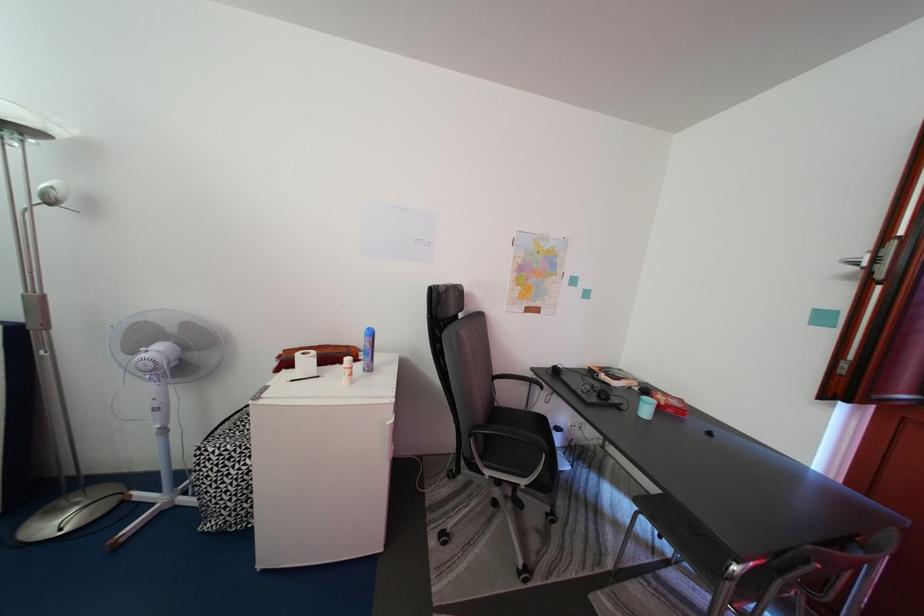
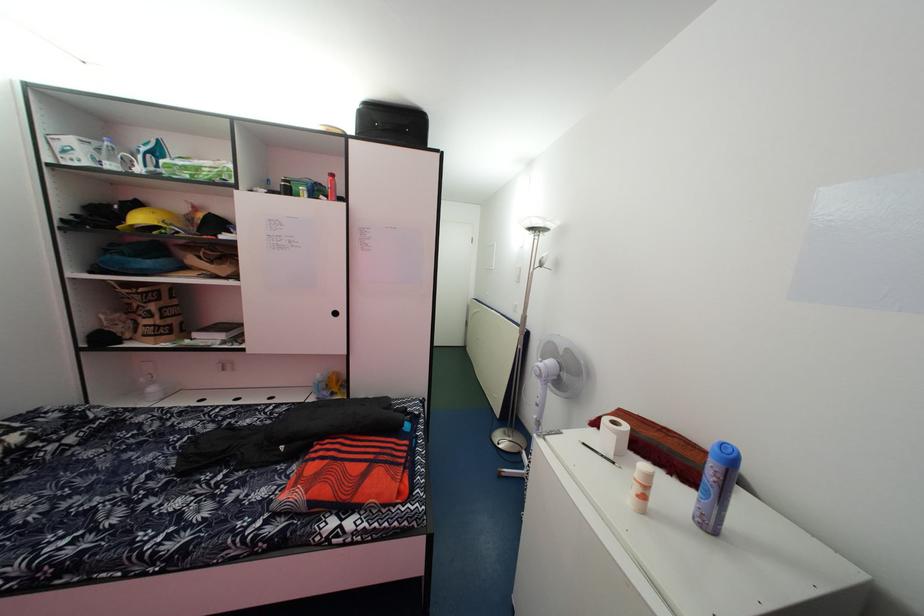
Where in the second image is the point corresponding to (x=381, y=341) from the first image?

(738, 466)